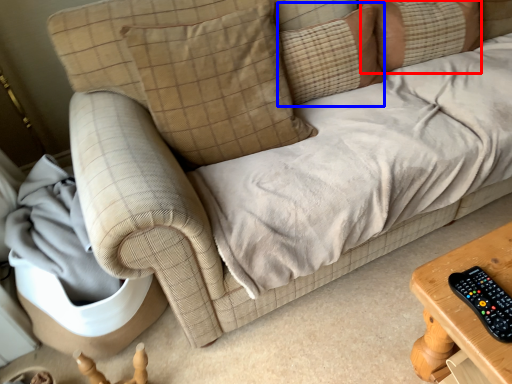
Question: Which point is closer to the camera, pillow (highlighted by a red box) or pillow (highlighted by a blue box)?

Choices:
 (A) pillow
 (B) pillow

Answer: (B)